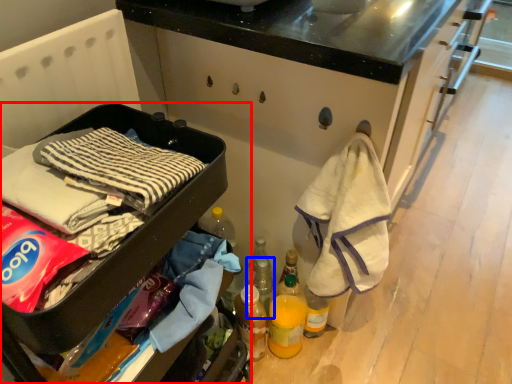
Question: Which object appears closest to the camera in this image, furniture (highlighted by a red box) or bottle (highlighted by a blue box)?

Choices:
 (A) furniture
 (B) bottle

Answer: (A)